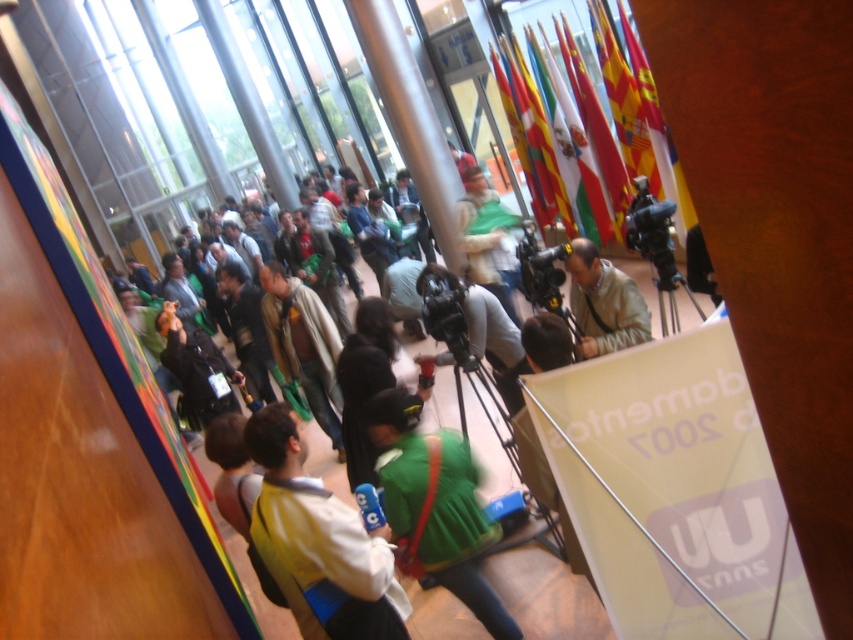
Question: In this image, where is yellow fabric jacket at center located relative to black plastic video camera at center right?

Choices:
 (A) left
 (B) right

Answer: (A)

Question: Can you confirm if yellow fabric flag at upper center is wider than black plastic video camera at center right?

Choices:
 (A) no
 (B) yes

Answer: (B)

Question: Which point is closer to the camera?

Choices:
 (A) (614, 200)
 (B) (610, 328)

Answer: (B)

Question: Considering the real-world distances, which object is closest to the yellow fabric flag at upper center?

Choices:
 (A) green fabric flag at center
 (B) black plastic video camera at center right
 (C) red flag at upper center
 (D) beige fabric jacket at center

Answer: (C)

Question: Can you confirm if beige fabric jacket at center is positioned to the left of green fabric flag at center?

Choices:
 (A) no
 (B) yes

Answer: (B)

Question: Estimate the real-world distances between objects in this image. Which object is closer to the red flag at upper center?

Choices:
 (A) beige fabric jacket at center
 (B) yellow fabric flag at upper center
 (C) green fabric flag at center

Answer: (B)